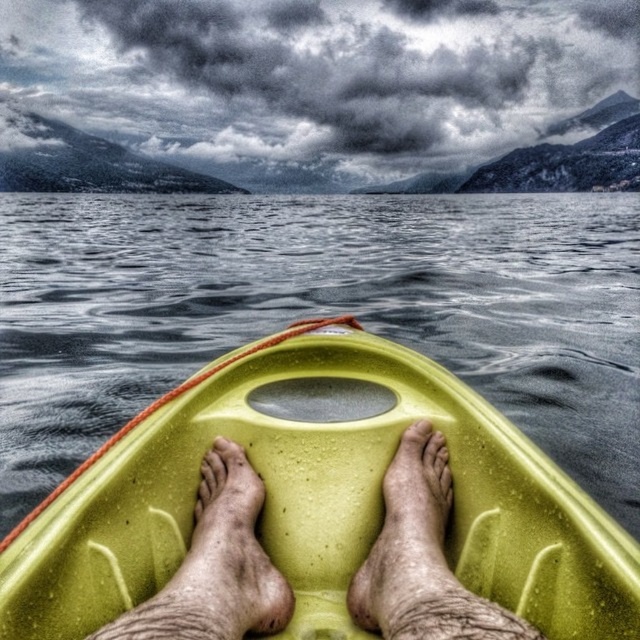
Question: Does green matte kayak at center have a larger size compared to matte yellow kayak at center?

Choices:
 (A) yes
 (B) no

Answer: (A)

Question: Is green matte kayak at center to the left of matte yellow kayak at center from the viewer's perspective?

Choices:
 (A) no
 (B) yes

Answer: (B)

Question: Is green matte kayak at center to the left of matte yellow kayak at center from the viewer's perspective?

Choices:
 (A) yes
 (B) no

Answer: (A)

Question: Which point appears closest to the camera in this image?

Choices:
 (A) (291, 442)
 (B) (410, 442)

Answer: (A)

Question: Among these points, which one is farthest from the camera?

Choices:
 (A) (316, 371)
 (B) (424, 426)

Answer: (A)